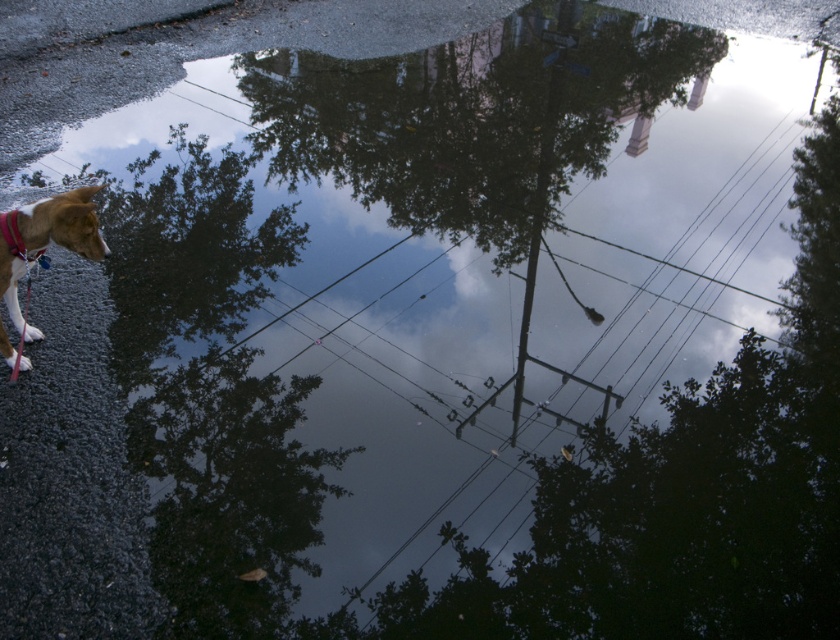
You are a photographer trying to capture the reflection in the puddle. You notice the brown fur dog at left and the red fabric collar at left in your shot. Which object is positioned lower in the image?

The brown fur dog at left is located below the red fabric collar at left, so it is positioned lower in the image.

You are a photographer trying to capture the reflection in the puddle. You notice the brown fur dog at left and the red fabric collar at left in your shot. Which object should you focus on to ensure the subject is clearer in the reflection?

The brown fur dog at left is larger in size than the red fabric collar at left, so focusing on the brown fur dog at left would result in a clearer subject in the reflection since larger objects generally provide more detail for focus.